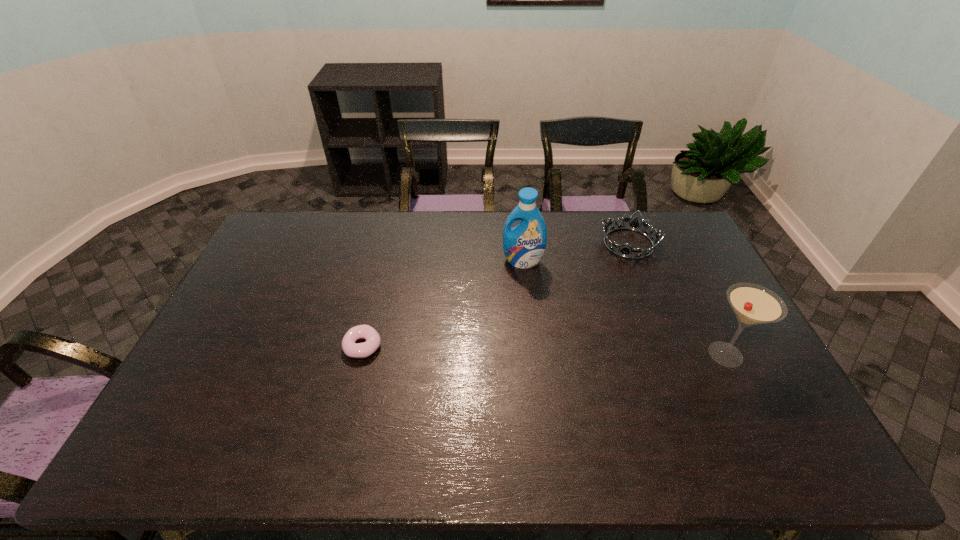
The width and height of the screenshot is (960, 540). Identify the location of vacant space on the desktop that is between the shortest object and the martini and is positioned on the front-facing side of the tallest object. (x=501, y=349).

This screenshot has width=960, height=540. I want to click on vacant space on the desktop that is between the doughnut and the third shortest object and is positioned on the front-facing side of the tiara, so click(x=590, y=352).